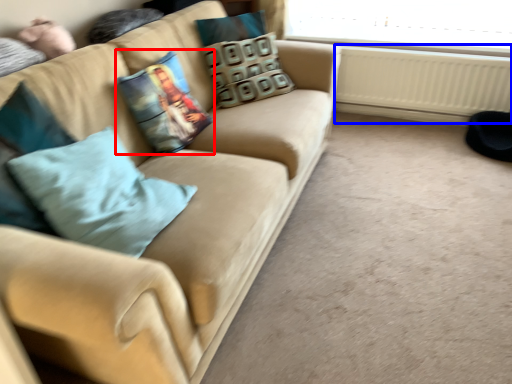
Question: Which point is further to the camera, pillow (highlighted by a red box) or radiator (highlighted by a blue box)?

Choices:
 (A) pillow
 (B) radiator

Answer: (B)